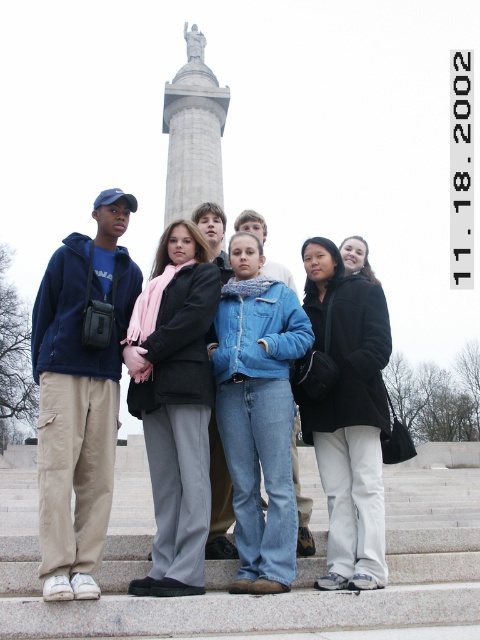
You are standing in front of the monument and want to take a photo of the black matte jacket at center and the gray stone column at center. Which object is positioned closer to the camera?

The black matte jacket at center is closer to the viewer than the gray stone column at center, so it is positioned closer to the camera.

You are standing on the steps and want to take a photo of the monument. The photographer asks you to move to the position where the black wool coat at center is currently located. Where should you move to in relation to the other people on the steps?

The black wool coat at center is located at coordinates point (346, 412), so you should move to that specific coordinate position on the steps to align with the photographer.

You are a photographer trying to adjust the positioning of the subjects in the image. You want to ensure that the black wool coat at center and the black matte jacket at center are both visible in the photo. Based on their current positions, which clothing item is blocking the view of the other?

Result: The black matte jacket at center is behind the black wool coat at center, so the black wool coat at center is blocking the view of the black matte jacket at center.